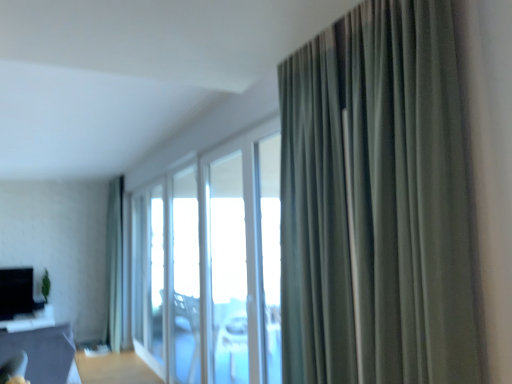
Question: In the image, is transparent glass window at center, the 2th window positioned from the front, positioned in front of or behind transparent glass window screen at center?

Choices:
 (A) front
 (B) behind

Answer: (A)

Question: Based on their sizes in the image, would you say transparent glass window at center, arranged as the 2th window when viewed from the back, is bigger or smaller than transparent glass window screen at center?

Choices:
 (A) small
 (B) big

Answer: (A)

Question: Which is farther from the transparent glass window screen at center?

Choices:
 (A) green fabric curtain at right, marked as the first curtain in a front-to-back arrangement
 (B) matte gray table at lower left
 (C) clear glass window at center, which ranks as the third window in back-to-front order
 (D) white glass screen door at center
 (E) transparent glass window at center, the 3th window when ordered from front to back

Answer: (A)

Question: Which is nearer to the transparent glass window at center, the 2th window positioned from the front?

Choices:
 (A) green fabric curtain at right, positioned as the 2th curtain in back-to-front order
 (B) transparent glass window screen at center
 (C) transparent glass window at center, which is counted as the 1th window, starting from the back
 (D) matte gray table at lower left
 (E) white glass screen door at center

Answer: (C)